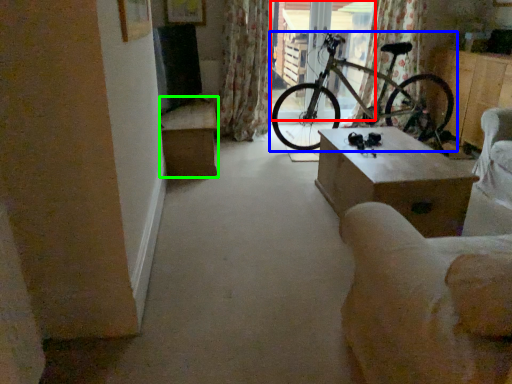
Question: Which object is positioned closest to window screen (highlighted by a red box)? Select from bicycle (highlighted by a blue box) and table (highlighted by a green box).

Choices:
 (A) bicycle
 (B) table

Answer: (A)